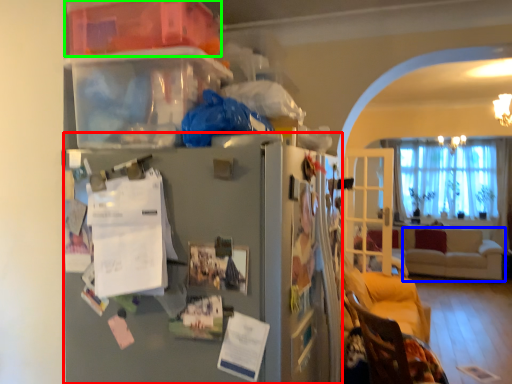
Question: Considering the real-world distances, which object is farthest from fridge (highlighted by a red box)? studio couch (highlighted by a blue box) or storage box (highlighted by a green box)?

Choices:
 (A) studio couch
 (B) storage box

Answer: (A)